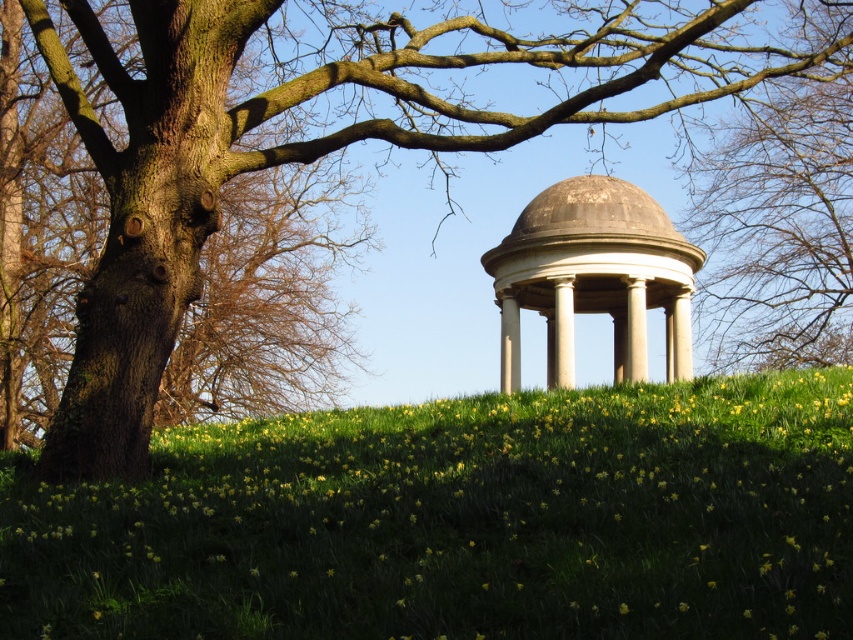
Which is in front, point (717, 458) or point (786, 316)?

Point (717, 458)

Describe the element at coordinates (460, 522) in the screenshot. I see `green grassy hillside at center` at that location.

Find the location of a particular element. green grassy hillside at center is located at coordinates (460, 522).

What are the coordinates of `brown rough tree at upper center` in the screenshot? It's located at (779, 225).

Does brown rough tree at upper center have a lesser width compared to stone gazebo at center?

In fact, brown rough tree at upper center might be wider than stone gazebo at center.

Identify the location of brown rough tree at upper center. (779, 225).

Which is below, green grassy hillside at center or stone gazebo at center?

green grassy hillside at center

The image size is (853, 640). What are the coordinates of `green grassy hillside at center` in the screenshot? It's located at (460, 522).

Which is behind, point (215, 442) or point (602, 248)?

The point (602, 248) is more distant.

This screenshot has width=853, height=640. I want to click on green grassy hillside at center, so click(x=460, y=522).